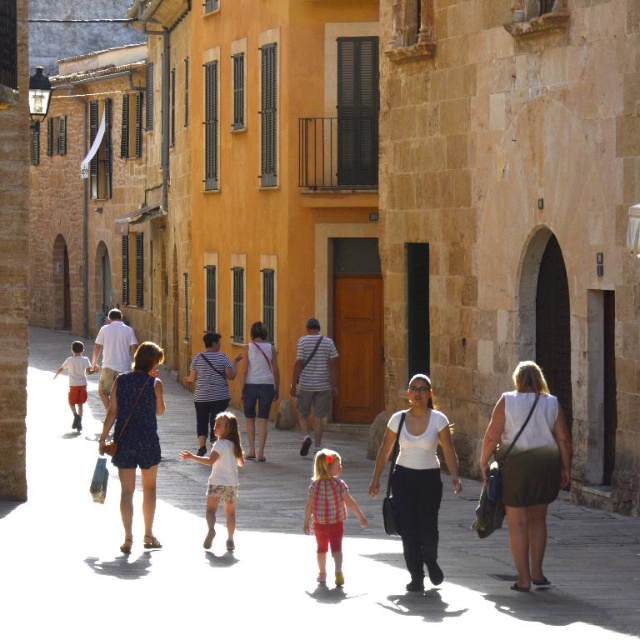
Question: Is plaid fabric shirt at center to the right of white cotton shirt at center from the viewer's perspective?

Choices:
 (A) yes
 (B) no

Answer: (A)

Question: Among these points, which one is farthest from the camera?

Choices:
 (A) (227, 532)
 (B) (93, 584)
 (C) (344, 513)
 (D) (72, 371)

Answer: (D)

Question: Which point appears farthest from the camera in this image?

Choices:
 (A) (29, 371)
 (B) (337, 528)
 (C) (88, 364)
 (D) (212, 464)

Answer: (A)

Question: Observing the image, what is the correct spatial positioning of matte white people at center in reference to plaid fabric shirt at center?

Choices:
 (A) above
 (B) below

Answer: (B)

Question: Among these objects, which one is farthest from the camera?

Choices:
 (A) plaid fabric shirt at center
 (B) orange cotton shorts at left
 (C) white cotton shirt at center
 (D) matte white people at center

Answer: (B)

Question: Can you confirm if matte white people at center is smaller than orange cotton shorts at left?

Choices:
 (A) no
 (B) yes

Answer: (B)